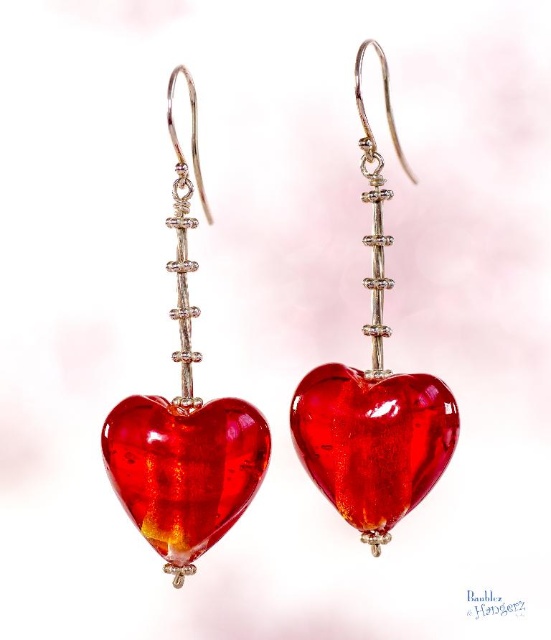
Who is more forward, (223, 461) or (213, 444)?

Point (223, 461)

The width and height of the screenshot is (551, 640). I want to click on matte glass heart at center, so click(183, 420).

Identify the location of matte glass heart at center. (183, 420).

Is shiny glass heart at center closer to camera compared to matte glass heart at center?

No, shiny glass heart at center is further to the viewer.

Find the location of a particular element. Image resolution: width=551 pixels, height=640 pixels. shiny glass heart at center is located at coordinates (374, 392).

Which is behind, point (456, 420) or point (334, 396)?

The point (334, 396) is more distant.

Find the location of `shiny glass heart at center`. shiny glass heart at center is located at coordinates (374, 392).

Who is more forward, (x=446, y=449) or (x=339, y=368)?

Point (x=446, y=449) is in front.

Locate an element on the screen. This screenshot has height=640, width=551. shiny glass heart at center is located at coordinates (374, 392).